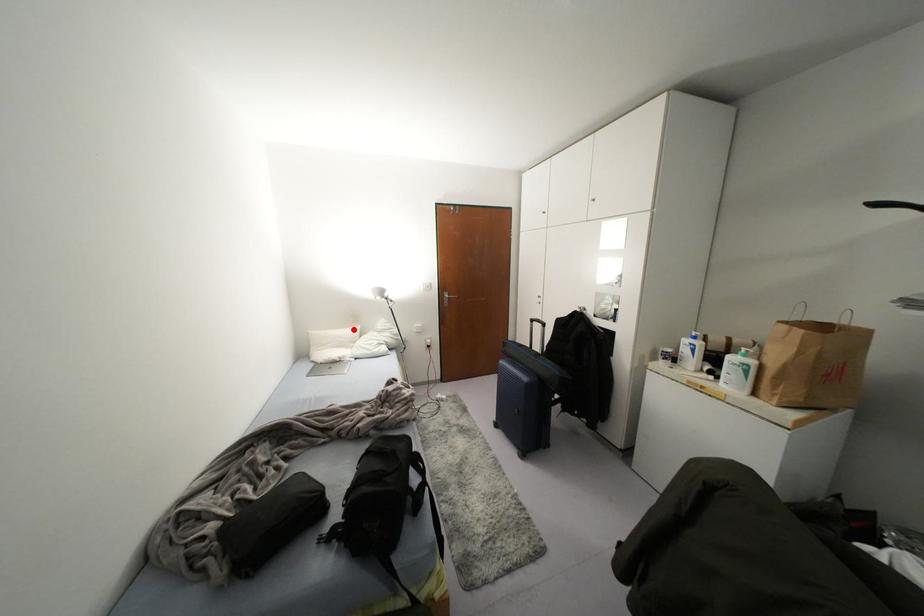
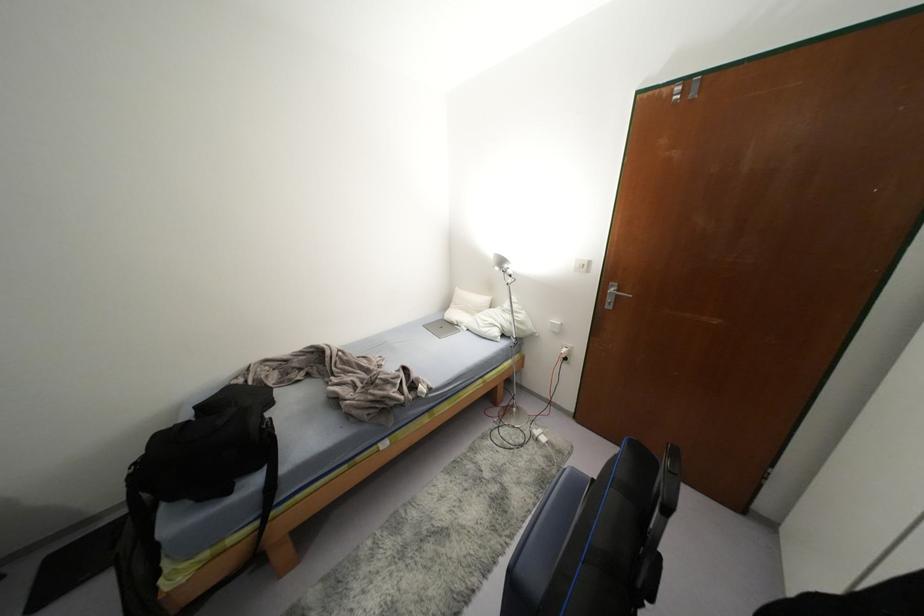
In the second image, find the point that corresponds to the highlighted location in the first image.

(484, 299)